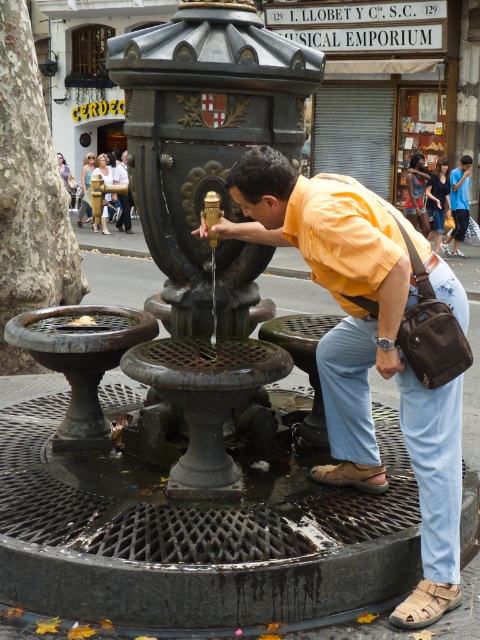
Consider the image. You are standing in the street scene and want to place two markers at the coordinates point (x=300, y=204) and point (x=321, y=474). Which marker will be closer to your current position?

The marker at point (x=300, y=204) will be closer to your current position because it is closer to the viewer than point (x=321, y=474).

You are a photographer trying to capture the man in the matte yellow shirt at center and his brown leather sandal at lower center in the same frame. Based on their positions, which object should you focus on first to ensure both are in the shot?

The brown leather sandal at lower center should be focused on first since the matte yellow shirt at center is to the right of it, so by centering the sandal, the shirt will naturally fall into the frame to its right.

You are standing at the point marked by the coordinates point (365, 324) in the image. Looking around, you see a man in a bright orange shirt and light blue jeans leaning over the fountain. Can you determine which direction the man is facing relative to your position?

The point (365, 324) is on the matte yellow shirt at center. Since the man is leaning over the fountain, he is facing towards the fountain, so you are facing the same direction as the man.